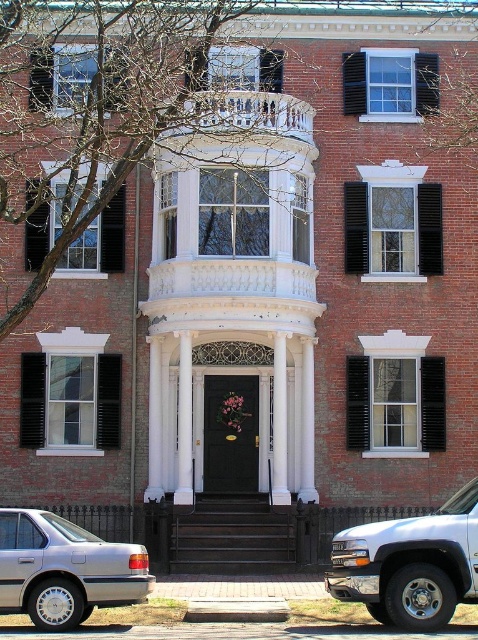
You are standing at the entrance of the classic brick building and want to know how far the white metallic suv at lower right is from you. Can you determine the distance?

The white metallic suv at lower right is 31.59 meters away from the viewer.

In the scene shown: You are standing at the front entrance of the classic brick building. You need to park your white metallic suv at lower right. Where should you position it relative to the building?

The white metallic suv at lower right should be positioned at the coordinates point [411,564] relative to the building.